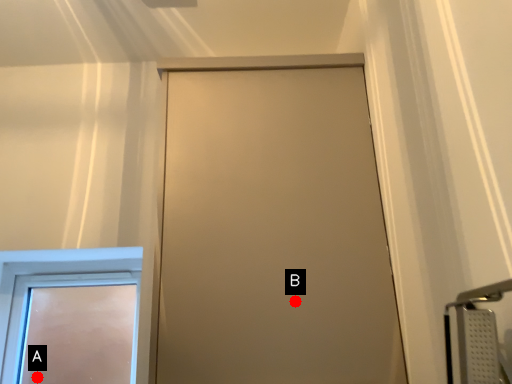
Question: Two points are circled on the image, labeled by A and B beside each circle. Which point is further to the camera?

Choices:
 (A) A is further
 (B) B is further

Answer: (A)